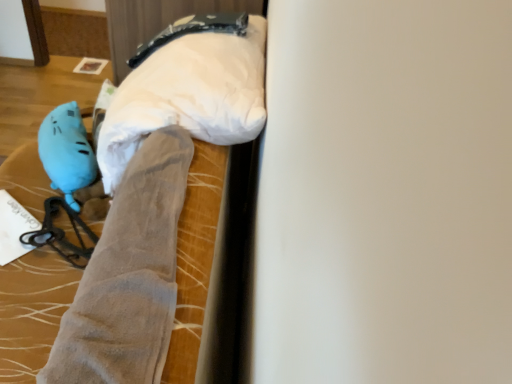
Question: From a real-world perspective, is blue rubber glove at lower left located beneath suede-like gray legging at center-left?

Choices:
 (A) yes
 (B) no

Answer: (A)

Question: Is blue rubber glove at lower left aimed at suede-like gray legging at center-left?

Choices:
 (A) no
 (B) yes

Answer: (A)

Question: Considering the relative sizes of blue rubber glove at lower left and suede-like gray legging at center-left in the image provided, is blue rubber glove at lower left wider than suede-like gray legging at center-left?

Choices:
 (A) no
 (B) yes

Answer: (A)

Question: Does blue rubber glove at lower left have a smaller size compared to suede-like gray legging at center-left?

Choices:
 (A) no
 (B) yes

Answer: (B)

Question: Is blue rubber glove at lower left thinner than suede-like gray legging at center-left?

Choices:
 (A) no
 (B) yes

Answer: (B)

Question: From the image's perspective, is white fabric pillow at upper center above or below suede-like gray legging at center-left?

Choices:
 (A) below
 (B) above

Answer: (B)

Question: Is white fabric pillow at upper center to the left or to the right of suede-like gray legging at center-left in the image?

Choices:
 (A) right
 (B) left

Answer: (A)

Question: Considering the positions of white fabric pillow at upper center and suede-like gray legging at center-left in the image, is white fabric pillow at upper center taller or shorter than suede-like gray legging at center-left?

Choices:
 (A) short
 (B) tall

Answer: (A)

Question: In the image, is white fabric pillow at upper center positioned in front of or behind suede-like gray legging at center-left?

Choices:
 (A) front
 (B) behind

Answer: (B)

Question: From the image's perspective, is matte blue plush at left positioned above or below velvet-like gray blanket at center?

Choices:
 (A) above
 (B) below

Answer: (A)

Question: Is matte blue plush at left in front of or behind velvet-like gray blanket at center in the image?

Choices:
 (A) front
 (B) behind

Answer: (B)

Question: From their relative heights in the image, would you say matte blue plush at left is taller or shorter than velvet-like gray blanket at center?

Choices:
 (A) tall
 (B) short

Answer: (B)

Question: Considering the positions of point (x=64, y=130) and point (x=27, y=354), is point (x=64, y=130) closer or farther from the camera than point (x=27, y=354)?

Choices:
 (A) farther
 (B) closer

Answer: (A)

Question: Is blue rubber glove at lower left in front of or behind matte blue plush at left in the image?

Choices:
 (A) behind
 (B) front

Answer: (B)

Question: From the image's perspective, is blue rubber glove at lower left located above or below matte blue plush at left?

Choices:
 (A) above
 (B) below

Answer: (B)